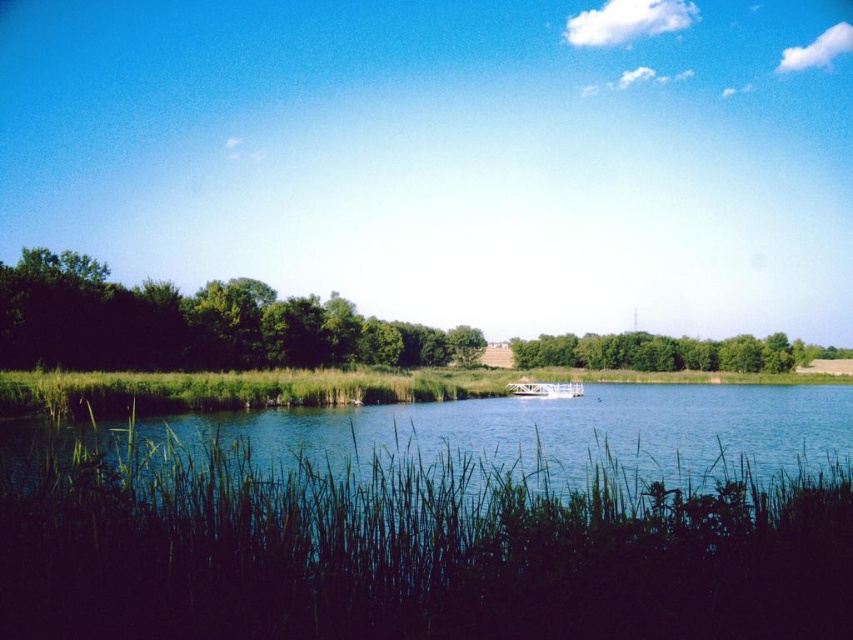
Question: Which object appears farthest from the camera in this image?

Choices:
 (A) green leafy trees at center
 (B) white glossy boat at center

Answer: (A)

Question: Which of the following is the closest to the observer?

Choices:
 (A) (276, 323)
 (B) (554, 385)
 (C) (656, 342)
 (D) (605, 397)

Answer: (D)

Question: Where is dark green leafy trees at left located in relation to green leafy trees at center in the image?

Choices:
 (A) below
 (B) above

Answer: (B)

Question: Which object appears farthest from the camera in this image?

Choices:
 (A) white glossy boat at center
 (B) green leafy trees at center
 (C) dark green leafy trees at left
 (D) green grassy river at center

Answer: (B)

Question: Does green grassy river at center appear on the left side of dark green leafy trees at left?

Choices:
 (A) yes
 (B) no

Answer: (B)

Question: Does green grassy river at center have a greater width compared to white glossy boat at center?

Choices:
 (A) no
 (B) yes

Answer: (B)